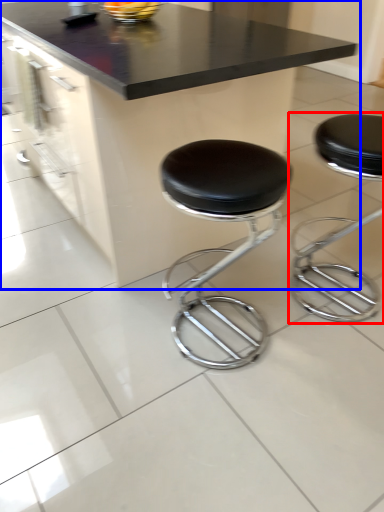
Question: Which object is further to the camera taking this photo, stool (highlighted by a red box) or table (highlighted by a blue box)?

Choices:
 (A) stool
 (B) table

Answer: (A)